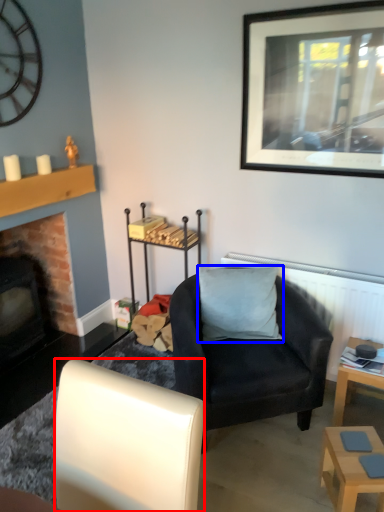
Question: Which object is further to the camera taking this photo, chair (highlighted by a red box) or pillow (highlighted by a blue box)?

Choices:
 (A) chair
 (B) pillow

Answer: (B)